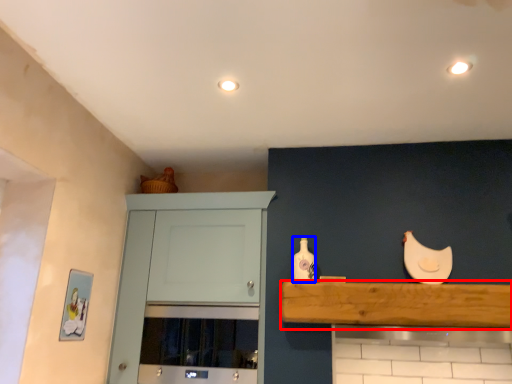
Question: Among these objects, which one is nearest to the camera, shelf (highlighted by a red box) or bottle (highlighted by a blue box)?

Choices:
 (A) shelf
 (B) bottle

Answer: (A)